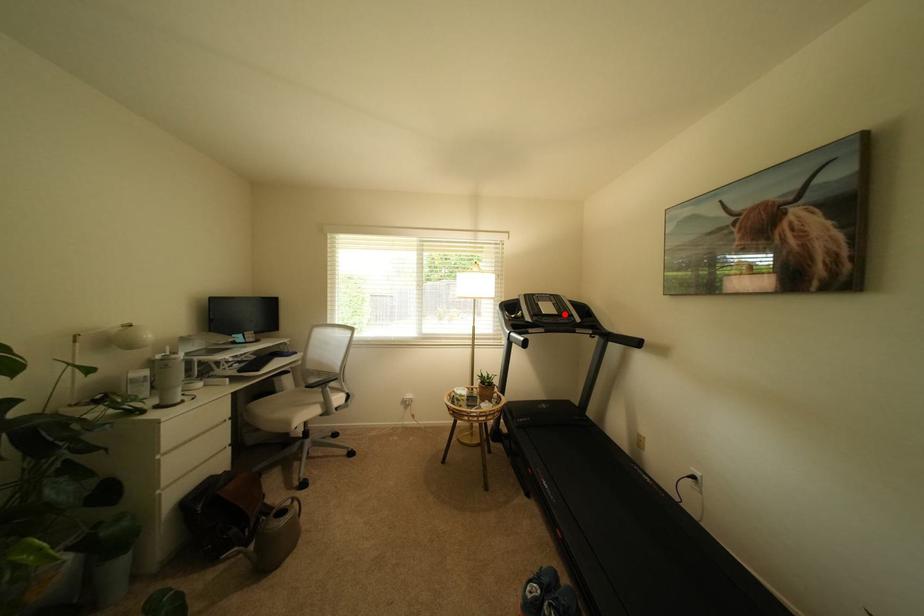
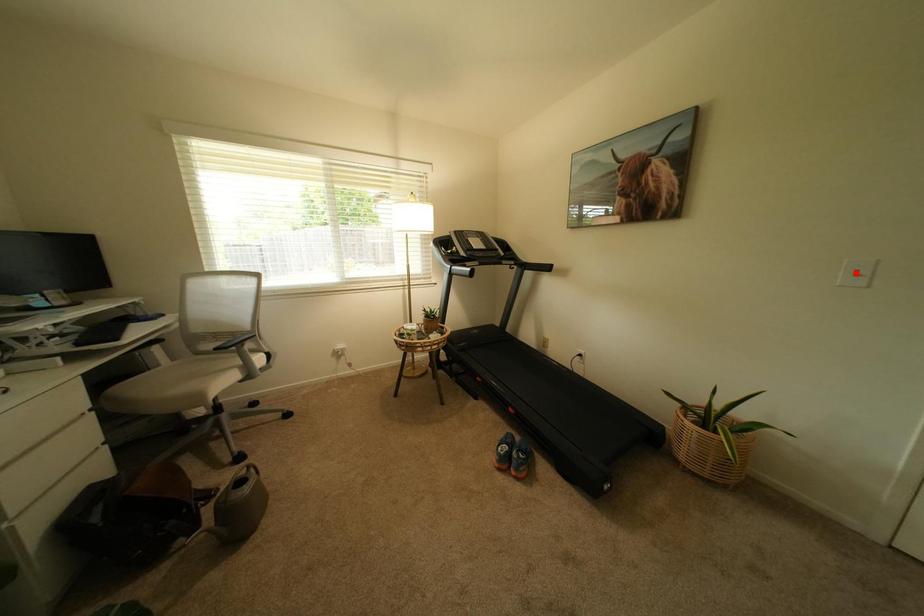
I am providing you with two images of the same scene from different viewpoints. A red point is marked on the first image and another point is marked on the second image. Does the point marked in image1 correspond to the same location as the one in image2?

No